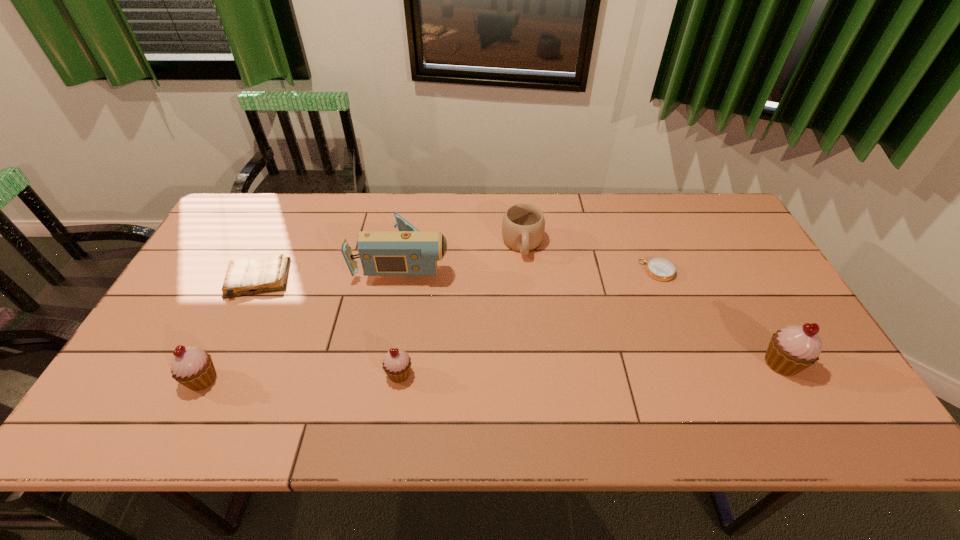
Identify the location of unoccupied area between the mug and the shortest object. (589, 257).

Image resolution: width=960 pixels, height=540 pixels. Find the location of `free space between the shortest cupcake and the compass`. free space between the shortest cupcake and the compass is located at coordinates (528, 322).

Locate an element on the screen. This screenshot has width=960, height=540. vacant space that is in between the fifth object from left to right and the rightmost object is located at coordinates (652, 303).

Locate an element on the screen. The width and height of the screenshot is (960, 540). free area in between the third object from right to left and the compass is located at coordinates click(589, 257).

Where is `vacant space in between the second cupcake from right to left and the fifth object from left to right`? This screenshot has width=960, height=540. vacant space in between the second cupcake from right to left and the fifth object from left to right is located at coordinates (461, 309).

The height and width of the screenshot is (540, 960). Find the location of `free space between the mug and the rightmost object`. free space between the mug and the rightmost object is located at coordinates [652, 303].

Point out which object is positioned as the fourth nearest to the camcorder. Please provide its 2D coordinates. Your answer should be formatted as a tuple, i.e. [(x, y)], where the tuple contains the x and y coordinates of a point satisfying the conditions above.

[(192, 367)]

Identify which object is located as the nearest to the second cupcake from right to left. Please provide its 2D coordinates. Your answer should be formatted as a tuple, i.e. [(x, y)], where the tuple contains the x and y coordinates of a point satisfying the conditions above.

[(407, 252)]

Locate an element on the screen. The height and width of the screenshot is (540, 960). cupcake that can be found as the closest to the shortest object is located at coordinates (792, 349).

Identify which cupcake is located as the nearest to the shortest object. Please provide its 2D coordinates. Your answer should be formatted as a tuple, i.e. [(x, y)], where the tuple contains the x and y coordinates of a point satisfying the conditions above.

[(792, 349)]